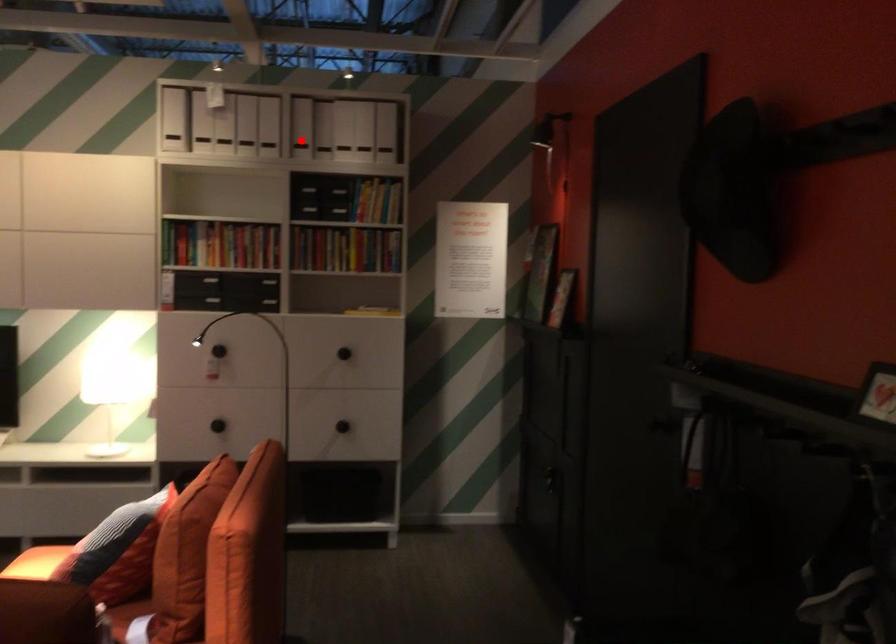
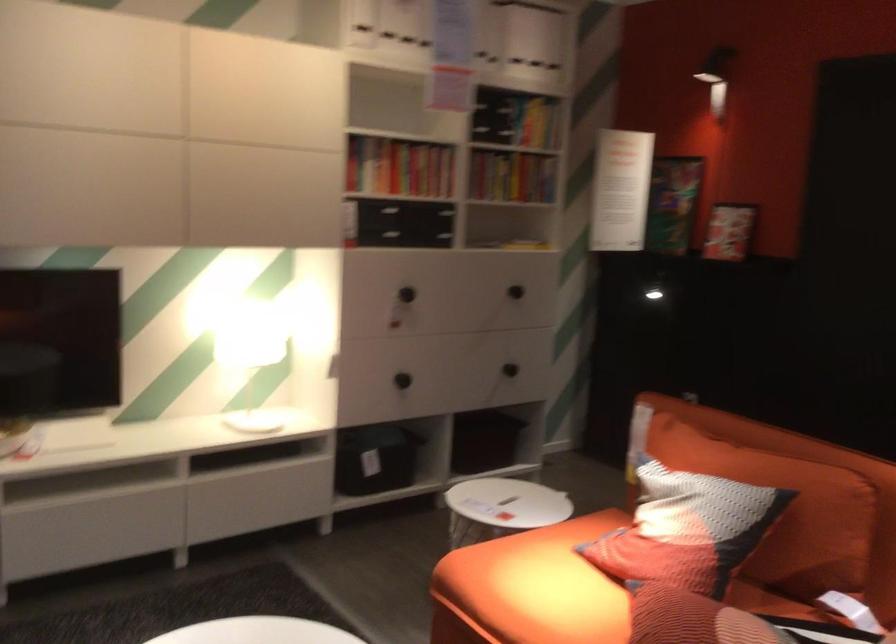
Question: I am providing you with two images of the same scene from different viewpoints. Given a red point in image1, look at the same physical point in image2. Is it:

Choices:
 (A) Closer to the viewpoint
 (B) Farther from the viewpoint

Answer: (A)